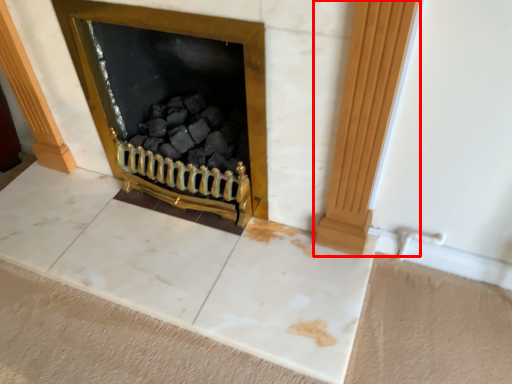
Question: Observing the image, what is the correct spatial positioning of pillar (annotated by the red box) in reference to fireplace?

Choices:
 (A) left
 (B) right

Answer: (B)